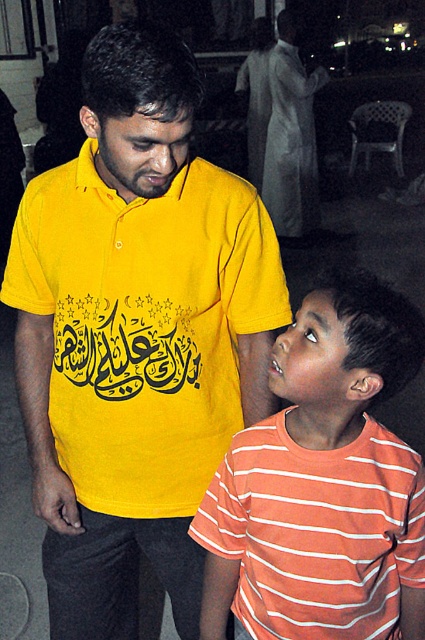
Question: Which of the following is the farthest from the observer?

Choices:
 (A) orange striped shirt at lower right
 (B) black calligraphy at center

Answer: (B)

Question: Can you confirm if orange striped shirt at lower right is wider than matte yellow shirt at center?

Choices:
 (A) yes
 (B) no

Answer: (B)

Question: Which of the following is the farthest from the observer?

Choices:
 (A) matte yellow shirt at center
 (B) orange striped shirt at lower right
 (C) black calligraphy at center

Answer: (A)

Question: Which point is farther to the camera?

Choices:
 (A) (107, 317)
 (B) (266, 627)

Answer: (A)

Question: Can you confirm if orange striped shirt at lower right is positioned to the left of black calligraphy at center?

Choices:
 (A) no
 (B) yes

Answer: (A)

Question: Is matte yellow polo shirt at center further to camera compared to black calligraphy at center?

Choices:
 (A) no
 (B) yes

Answer: (A)